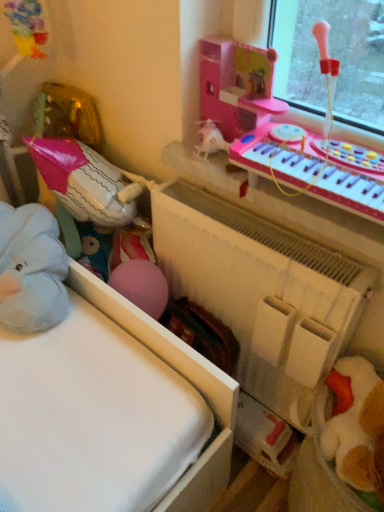
This screenshot has width=384, height=512. I want to click on free point above pink plastic musical keyboard at upper right (from a real-world perspective), so 328,151.